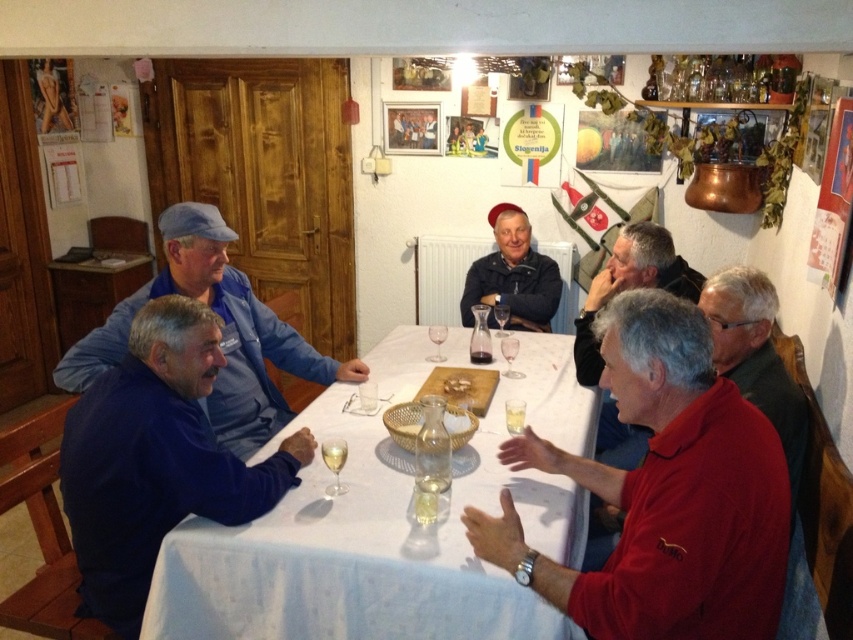
Question: Is white cloth table at center above blue denim jacket at left?

Choices:
 (A) yes
 (B) no

Answer: (B)

Question: Which object is the closest to the clear glass wine glass at lower center?

Choices:
 (A) transparent glass at table center
 (B) white ceramic plate at center
 (C) clear glass wine glass at center

Answer: (B)

Question: Among these points, which one is nearest to the camera?

Choices:
 (A) (654, 529)
 (B) (467, 384)
 (C) (558, 637)
 (D) (491, 358)

Answer: (A)

Question: Can you confirm if blue denim jacket at left is positioned below transparent glass at table center?

Choices:
 (A) yes
 (B) no

Answer: (A)

Question: Does white cloth table at center have a greater width compared to blue denim jacket at left?

Choices:
 (A) no
 (B) yes

Answer: (B)

Question: Which point appears closest to the camera in this image?

Choices:
 (A) (496, 305)
 (B) (480, 358)

Answer: (B)